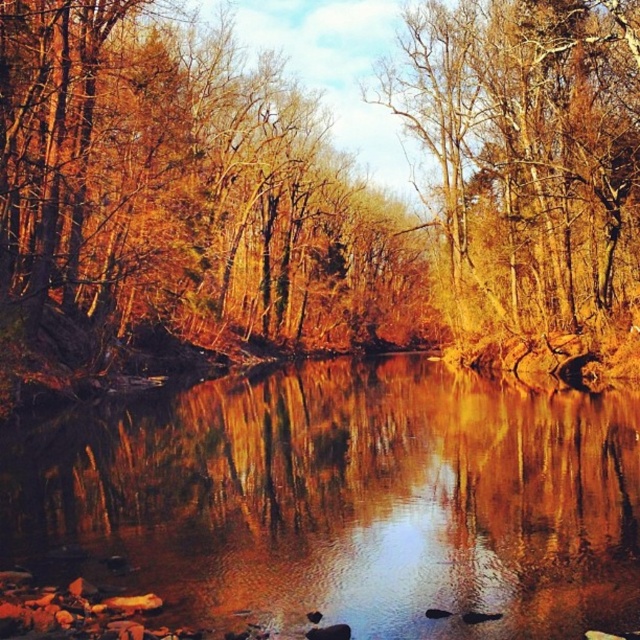
Question: Is shiny reflective water at center positioned behind golden textured tree at upper center?

Choices:
 (A) yes
 (B) no

Answer: (B)

Question: Which object appears closest to the camera in this image?

Choices:
 (A) golden textured tree at upper center
 (B) shiny reflective water at center

Answer: (B)

Question: Which of the following is the farthest from the observer?

Choices:
 (A) (x=209, y=564)
 (B) (x=449, y=86)

Answer: (B)

Question: Does shiny reflective water at center have a smaller size compared to golden textured tree at upper center?

Choices:
 (A) no
 (B) yes

Answer: (B)

Question: Does shiny reflective water at center appear on the left side of golden textured tree at upper center?

Choices:
 (A) no
 (B) yes

Answer: (B)

Question: Among these points, which one is farthest from the camera?

Choices:
 (A) (465, 42)
 (B) (61, 568)

Answer: (A)